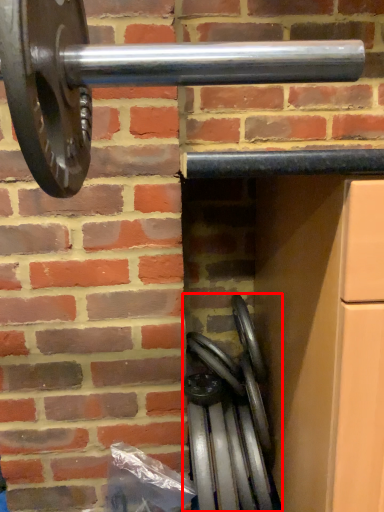
Question: Considering the relative positions of wheel (annotated by the red box) and wheel in the image provided, where is wheel (annotated by the red box) located with respect to the staircase?

Choices:
 (A) right
 (B) left

Answer: (A)